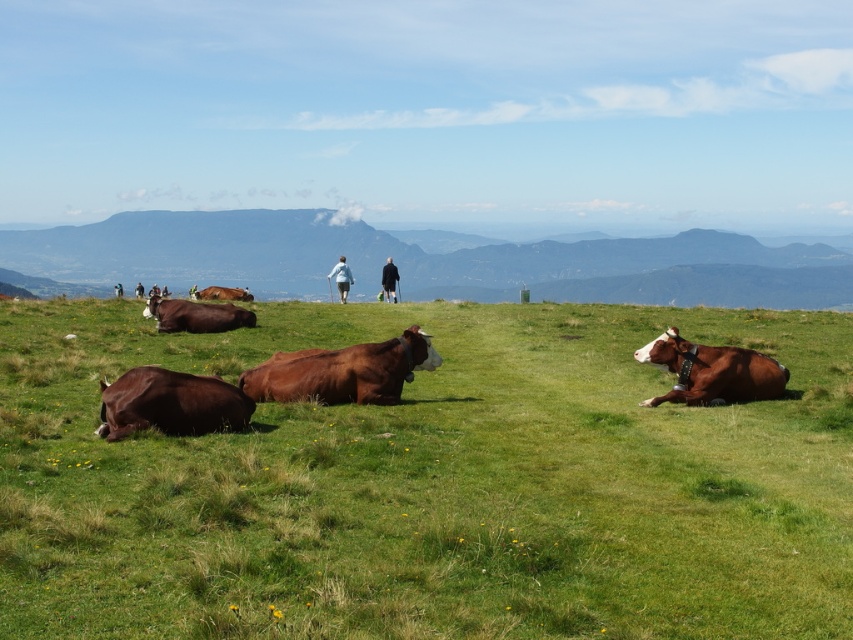
You are standing in the meadow and want to find the cow that is closer to the mountains. Which cow should you look for, the brown smooth cow at lower left or the brown leather cow at right?

The brown smooth cow at lower left is located below the brown leather cow at right, which means it is closer to the mountains. Therefore, you should look for the brown smooth cow at lower left.

You are standing in the meadow and want to take a photo of the brown leather cow at right without the green grass at center blocking the view. Is this possible?

The green grass at center is closer to the viewer than the brown leather cow at right, so the green grass at center would block the view of the brown leather cow at right. You would need to move to a position where the green grass at center is not between you and the brown leather cow at right.